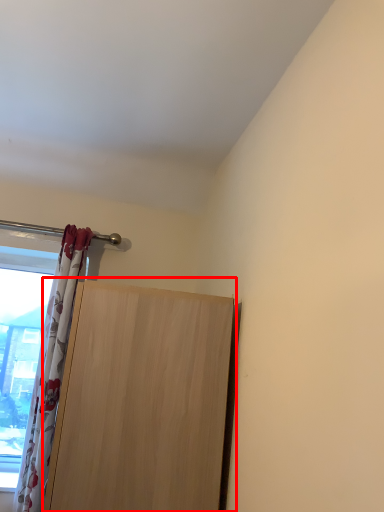
Question: From the image, what is the correct spatial relationship of door (annotated by the red box) in relation to curtain?

Choices:
 (A) right
 (B) left

Answer: (A)